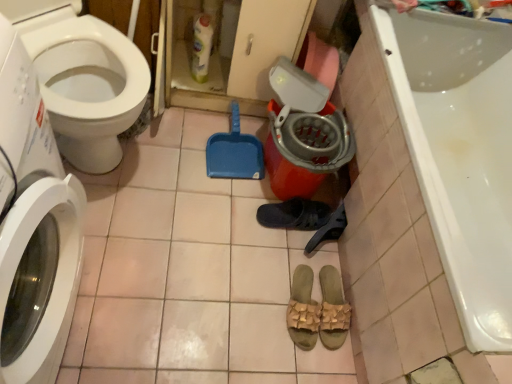
Question: Does white glossy toilet at left have a smaller size compared to tan woven sandals at center, marked as the 3th footwear in a top-to-bottom arrangement?

Choices:
 (A) no
 (B) yes

Answer: (A)

Question: Can you confirm if white glossy toilet at left is positioned to the right of tan woven sandals at center, the first footwear when ordered from bottom to top?

Choices:
 (A) yes
 (B) no

Answer: (B)

Question: Is white glossy toilet at left positioned before tan woven sandals at center, the first footwear when ordered from bottom to top?

Choices:
 (A) yes
 (B) no

Answer: (A)

Question: Is white glossy toilet at left bigger than tan woven sandals at center, marked as the 3th footwear in a top-to-bottom arrangement?

Choices:
 (A) yes
 (B) no

Answer: (A)

Question: Could you tell me if white glossy toilet at left is turned towards tan woven sandals at center, marked as the 3th footwear in a top-to-bottom arrangement?

Choices:
 (A) yes
 (B) no

Answer: (A)

Question: Based on their sizes in the image, would you say orange plastic bucket at center is bigger or smaller than translucent plastic bottle at upper center?

Choices:
 (A) small
 (B) big

Answer: (B)

Question: Looking at their shapes, would you say orange plastic bucket at center is wider or thinner than translucent plastic bottle at upper center?

Choices:
 (A) wide
 (B) thin

Answer: (A)

Question: From the image's perspective, relative to translucent plastic bottle at upper center, is orange plastic bucket at center above or below?

Choices:
 (A) below
 (B) above

Answer: (A)

Question: Is point (271, 142) closer or farther from the camera than point (194, 59)?

Choices:
 (A) closer
 (B) farther

Answer: (A)

Question: Based on their sizes in the image, would you say orange plastic bucket at center is bigger or smaller than black rubber shoe at center?

Choices:
 (A) big
 (B) small

Answer: (A)

Question: In the image, is orange plastic bucket at center positioned in front of or behind black rubber shoe at center?

Choices:
 (A) front
 (B) behind

Answer: (A)

Question: Is orange plastic bucket at center situated inside black rubber shoe at center or outside?

Choices:
 (A) outside
 (B) inside

Answer: (A)

Question: Would you say orange plastic bucket at center is to the left or to the right of black rubber shoe at center in the picture?

Choices:
 (A) left
 (B) right

Answer: (A)

Question: Is pink tile at lower center taller or shorter than white glossy bathtub at lower right?

Choices:
 (A) tall
 (B) short

Answer: (B)

Question: From a real-world perspective, is pink tile at lower center positioned above or below white glossy bathtub at lower right?

Choices:
 (A) below
 (B) above

Answer: (A)